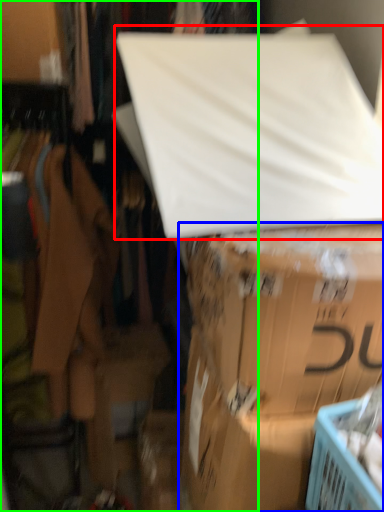
Question: Considering the real-world distances, which object is closest to linen (highlighted by a red box)? box (highlighted by a blue box) or closet (highlighted by a green box).

Choices:
 (A) box
 (B) closet

Answer: (A)